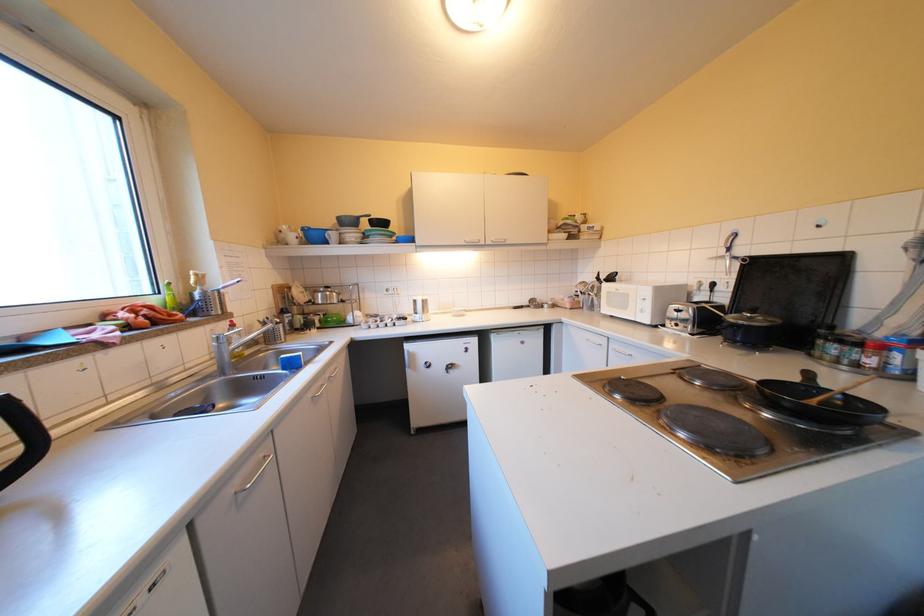
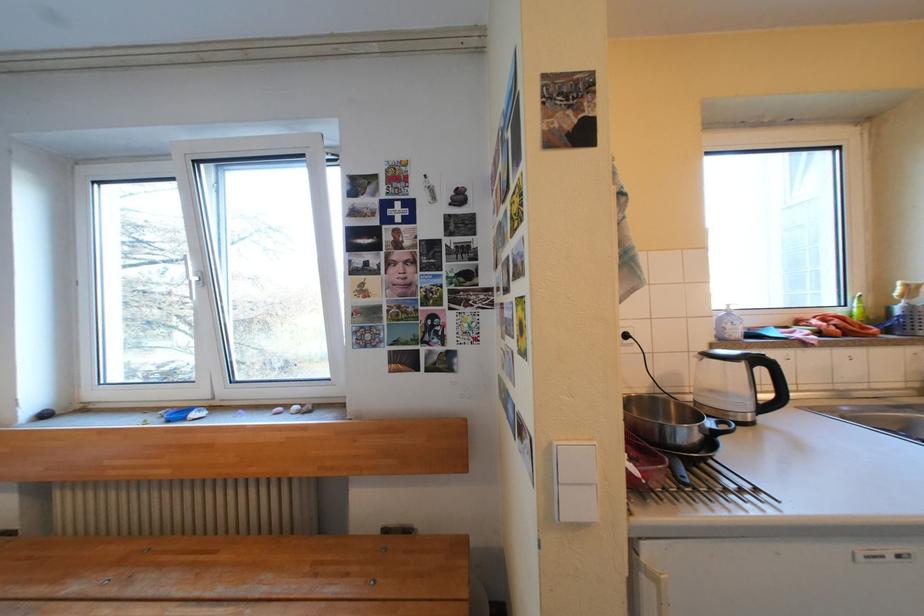
Question: The camera is either moving clockwise (left) or counter-clockwise (right) around the object. The first image is from the beginning of the video and the second image is from the end. Is the camera moving left or right when shooting the video?

Choices:
 (A) Left
 (B) Right

Answer: (B)